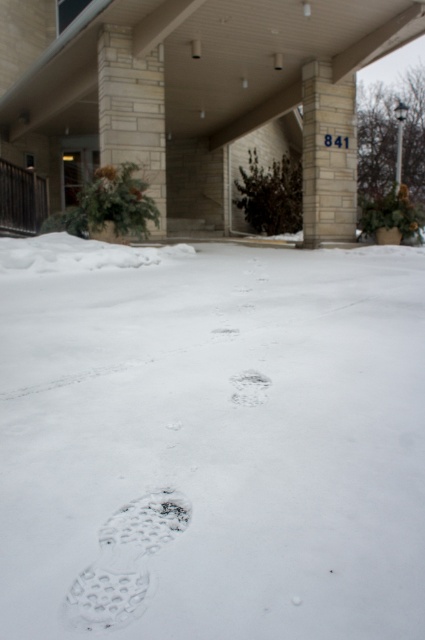
Question: Which point is farther from the camera taking this photo?

Choices:
 (A) (261, 390)
 (B) (73, 604)

Answer: (A)

Question: Can you confirm if white fluffy snow at center is positioned above white textured shoe print at lower left?

Choices:
 (A) no
 (B) yes

Answer: (B)

Question: Which is farther from the white textured shoe print at lower left?

Choices:
 (A) white fluffy snow at center
 (B) white matte footprint at center

Answer: (A)

Question: Can you confirm if white fluffy snow at center is positioned above white textured shoe print at lower left?

Choices:
 (A) yes
 (B) no

Answer: (A)

Question: Among these points, which one is farthest from the camera?

Choices:
 (A) (234, 381)
 (B) (181, 516)
 (C) (320, 516)

Answer: (A)

Question: Can you confirm if white fluffy snow at center is positioned to the right of white matte footprint at center?

Choices:
 (A) no
 (B) yes

Answer: (A)